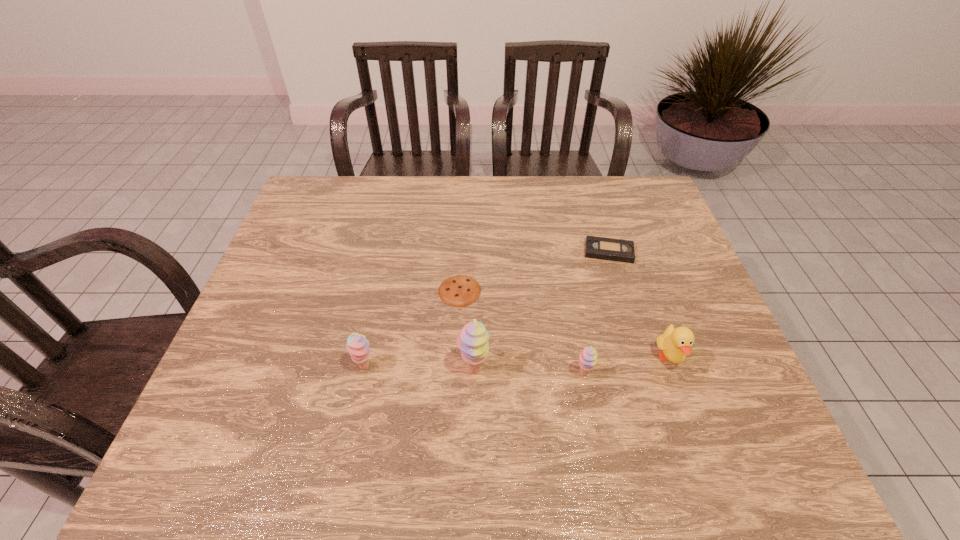
Identify the location of cookie. This screenshot has width=960, height=540. (460, 290).

Identify the location of free space located on the back of the leftmost sherbert. Image resolution: width=960 pixels, height=540 pixels. (372, 337).

I want to click on vacant space situated on the right of the tallest sherbert, so click(541, 370).

This screenshot has width=960, height=540. Identify the location of free location located 0.090m on the left of the shortest sherbert. (535, 373).

You are a GUI agent. You are given a task and a screenshot of the screen. Output one action in this format:
    pyautogui.click(x=<x>, y=<y>)
    Task: Click on the vacant space situated 0.080m on the front-facing side of the duckling
    The image size is (960, 540).
    Given the screenshot: What is the action you would take?
    pyautogui.click(x=687, y=410)

The height and width of the screenshot is (540, 960). Find the location of `vacant space located 0.190m on the back of the videotape`. vacant space located 0.190m on the back of the videotape is located at coordinates (594, 202).

Locate an element on the screen. This screenshot has width=960, height=540. free space located 0.180m on the back of the cookie is located at coordinates (462, 233).

What are the coordinates of `object present at the near edge` in the screenshot? It's located at (472, 341).

Identify the location of duckling that is at the right edge. (675, 343).

At what (x,y) coordinates should I click in order to perform the action: click on videotape at the right edge. Please return your answer as a coordinate pair (x, y). The width and height of the screenshot is (960, 540). Looking at the image, I should click on (602, 248).